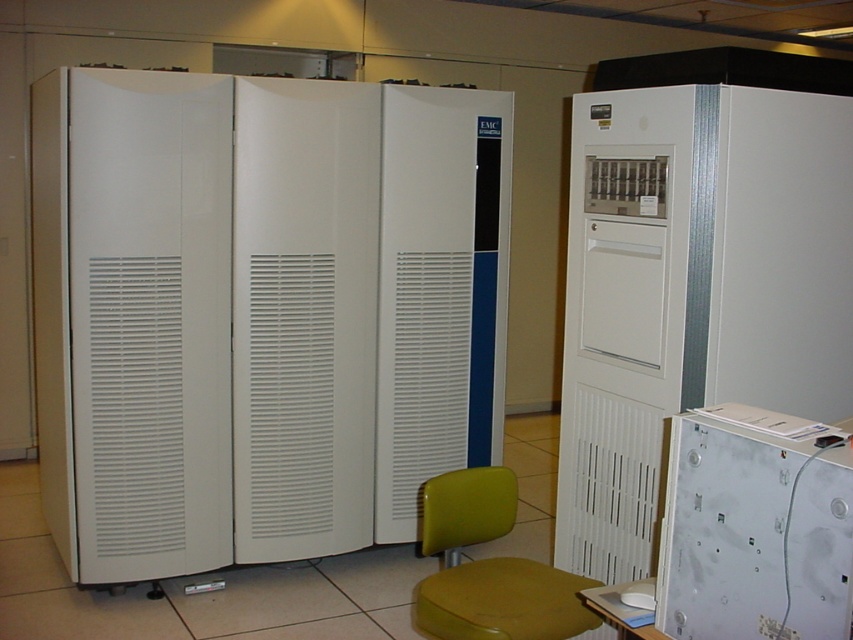
You are standing in the middle of the room and want to reach the white matte refrigerator at center. Which direction should you move to get closer to it?

Since the white matte refrigerator at center is located at point coordinates of (x=260, y=312), you should move forward slightly because you are already in the center of the room, so the refrigerator is directly in front of you.

You are standing in the server room and see the white matte refrigerator at center and the yellow plastic stool at center. Which object is closer to you?

The white matte refrigerator at center is positioned over the yellow plastic stool at center, meaning the refrigerator is closer to you.

You are standing in the server room and need to access the white plastic cabinet at lower right. However, there is a white matte refrigerator at center blocking your path. Can you move the refrigerator to reach the cabinet?

The white matte refrigerator at center is above the white plastic cabinet at lower right, so the refrigerator cannot physically block the path to the cabinet since it is positioned higher up.